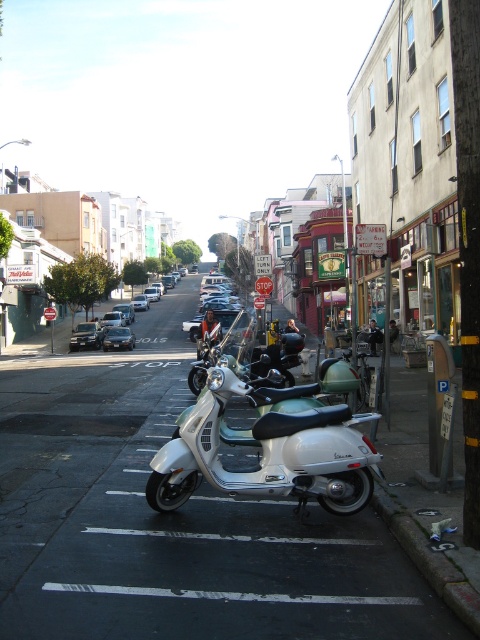
You are a delivery driver who needs to park your scooter in a spot that is exactly the same size as the white painted line at lower center. Can you fit the white metallic scooter at center into that spot?

The white metallic scooter at center is bigger than the white painted line at lower center, so it cannot fit into a spot that is exactly the same size as the white painted line at lower center.